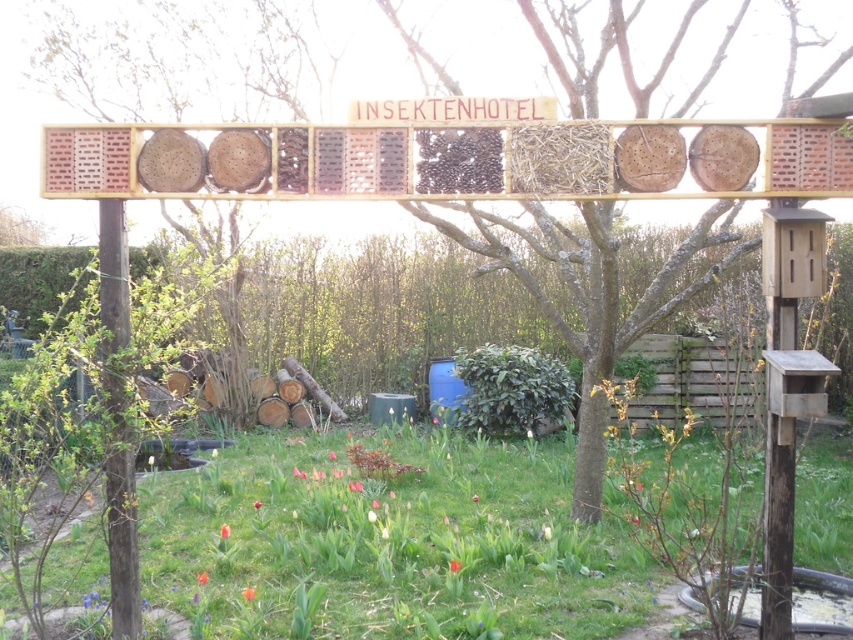
From the picture: You are a gardener who wants to plant a new flower bed between the green grass at lower center and the brown textured wood at center. Based on their positions, which object should you start digging near first?

→ The green grass at lower center is positioned under the brown textured wood at center, so you should start digging near the green grass at lower center first as it is closer to the ground level.

You are a gardener who needs to place a 2 meter long wooden bench between the green grass at lower center and the brown textured wood at center. Will the bench fit in the space between them?

The distance between the green grass at lower center and the brown textured wood at center is 2.17 meters. Since the bench is 2 meters long, it will fit with some space to spare.

You are a gardener planning to place a new flower bed in the garden. The flower bed needs to be placed at coordinates point A, which is at the same location as the green grass at lower center. Where should you place the flower bed?

The flower bed should be placed at the coordinates point A, which is at the same location as the green grass at lower center, specifically at point [387,544].